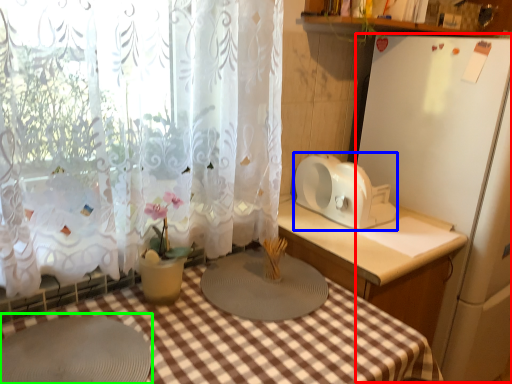
Question: Considering the real-world distances, which object is farthest from appliance (highlighted by a red box)? appliance (highlighted by a blue box) or round table (highlighted by a green box)?

Choices:
 (A) appliance
 (B) round table

Answer: (B)